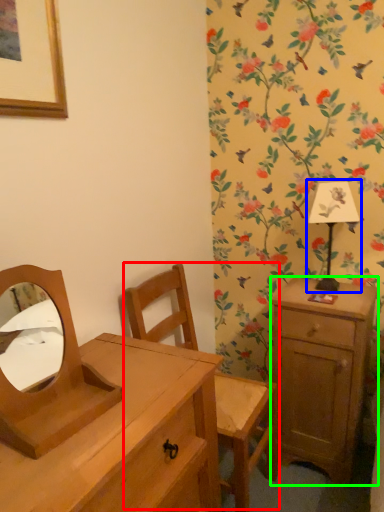
Question: Which object is positioned farthest from swivel chair (highlighted by a red box)? Select from bedside lamp (highlighted by a blue box) and nightstand (highlighted by a green box).

Choices:
 (A) bedside lamp
 (B) nightstand

Answer: (A)